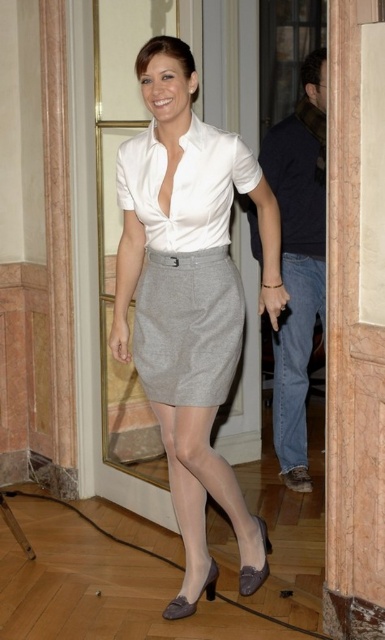
Question: Is denim jeans at right thinner than white satin blouse at center?

Choices:
 (A) no
 (B) yes

Answer: (B)

Question: In this image, where is matte white blouse at center located relative to matte gray heel at lower center?

Choices:
 (A) right
 (B) left

Answer: (B)

Question: Can you confirm if gray woolen skirt at center is positioned above white satin blouse at center?

Choices:
 (A) no
 (B) yes

Answer: (A)

Question: Which point is closer to the camera?

Choices:
 (A) (264, 545)
 (B) (185, 264)
 (C) (289, 118)
 (D) (212, 579)

Answer: (B)

Question: Which point is closer to the camera taking this photo?

Choices:
 (A) (311, 312)
 (B) (142, 68)

Answer: (B)

Question: Which point is closer to the camera?

Choices:
 (A) matte gray heel at lower center
 (B) gray wool skirt at center
 (C) matte gray shoe at lower center
 (D) denim jeans at right

Answer: (B)